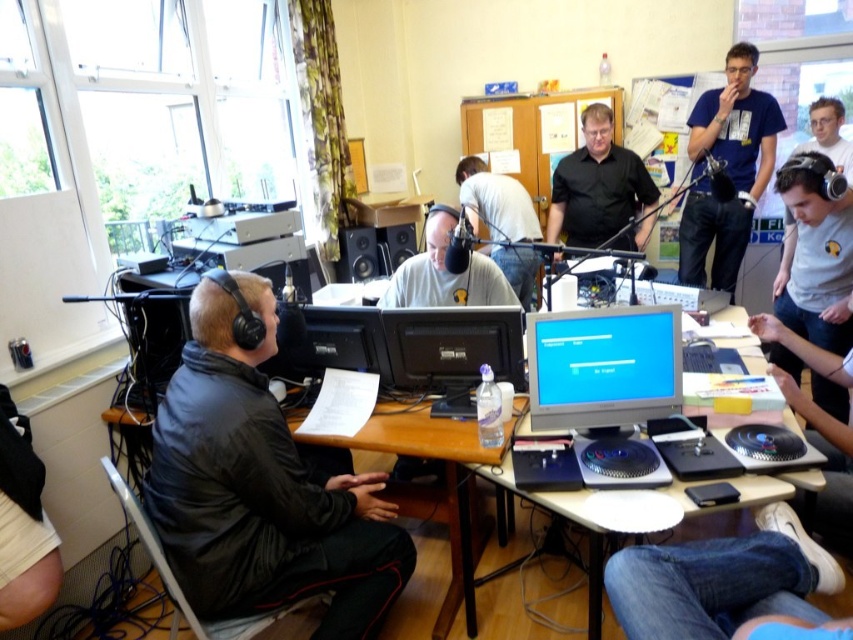
You are a guest entering the radio station studio and want to sit between the black matte jacket at left and the matte gray shirt at center. Can you comfortably sit in that space?

The black matte jacket at left might be wider than matte gray shirt at center, so the space between them may be limited. It is uncertain if there is enough room for you to sit comfortably between them.

You are a technician in the radio station studio. You need to adjust the light gray shirt at center so that it doesn not block the black matte monitor at center. Since the monitor is wider than the shirt, how should you position the shirt relative to the monitor to ensure it stays out of the way?

The black matte monitor at center is wider than the light gray shirt at center. To prevent the shirt from blocking the monitor, position the light gray shirt at center to the side of the black matte monitor at center, ensuring it does not overlap the monitor due to its narrower width.